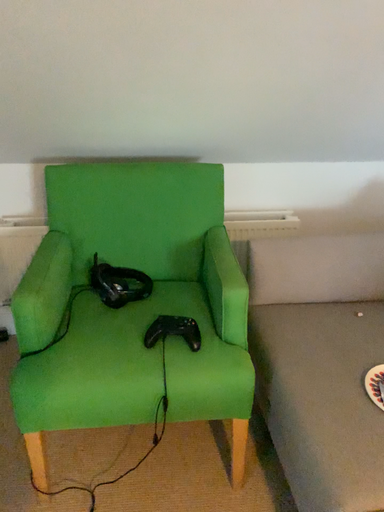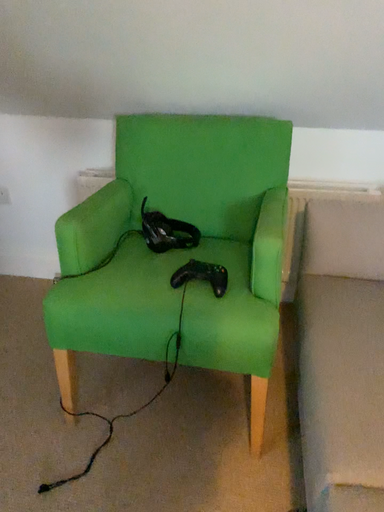
Question: Which way did the camera rotate in the video?

Choices:
 (A) rotated right
 (B) rotated left

Answer: (B)